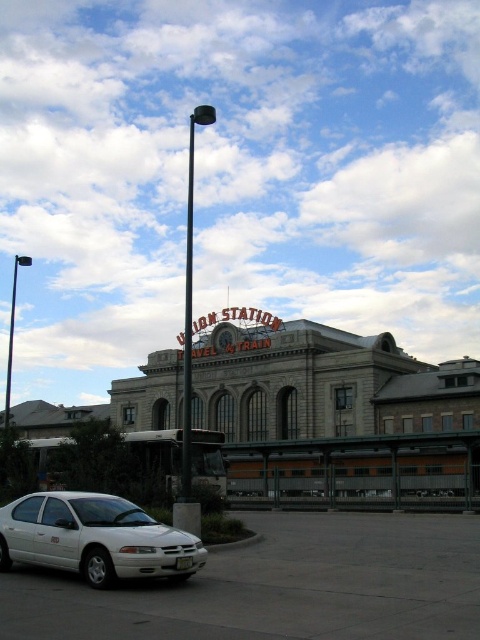
Question: In this image, where is white matte sedan at lower left located relative to black metal pole at center?

Choices:
 (A) below
 (B) above

Answer: (A)

Question: Among these points, which one is nearest to the camera?

Choices:
 (A) (92, 573)
 (B) (191, 237)
 (C) (192, 132)
 (D) (7, 388)

Answer: (A)

Question: Is stone building at center smaller than black metal pole at upper center?

Choices:
 (A) no
 (B) yes

Answer: (B)

Question: Among these points, which one is farthest from the camera?

Choices:
 (A) (13, 266)
 (B) (129, 563)
 (C) (247, 378)
 (D) (192, 136)

Answer: (D)

Question: Which object is closer to the camera taking this photo?

Choices:
 (A) white matte sedan at lower left
 (B) stone building at center

Answer: (A)

Question: Is stone building at center closer to camera compared to black metal pole at center?

Choices:
 (A) no
 (B) yes

Answer: (A)